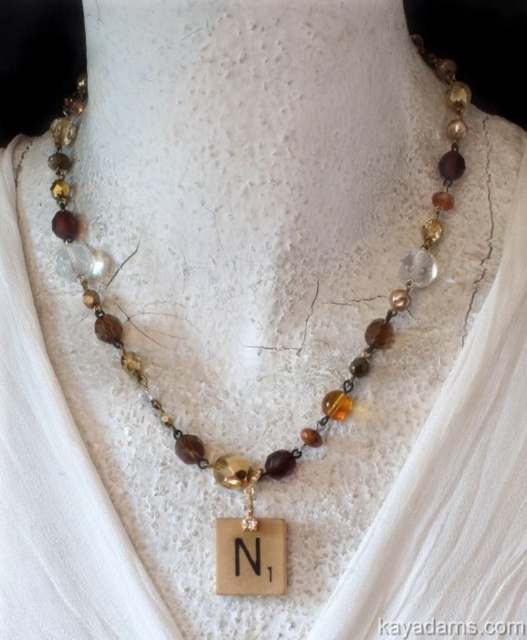
Question: Which object appears farthest from the camera in this image?

Choices:
 (A) translucent glass beads at center
 (B) wooden square at center

Answer: (B)

Question: Considering the relative positions of translucent glass beads at center and wooden square at center in the image provided, where is translucent glass beads at center located with respect to wooden square at center?

Choices:
 (A) below
 (B) above

Answer: (B)

Question: Can you confirm if translucent glass beads at center is positioned above wooden square at center?

Choices:
 (A) yes
 (B) no

Answer: (A)

Question: Is translucent glass beads at center above wooden square at center?

Choices:
 (A) no
 (B) yes

Answer: (B)

Question: Which point is closer to the camera taking this photo?

Choices:
 (A) (217, 532)
 (B) (248, 552)

Answer: (B)

Question: Which point is farther from the camera taking this photo?

Choices:
 (A) (237, 560)
 (B) (431, 216)

Answer: (B)